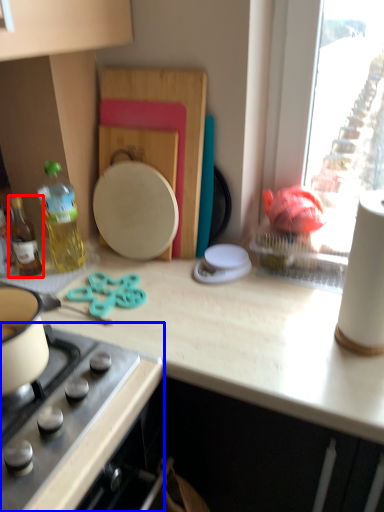
Question: Which object appears closest to the camera in this image, bottle (highlighted by a red box) or gas stove (highlighted by a blue box)?

Choices:
 (A) bottle
 (B) gas stove

Answer: (B)